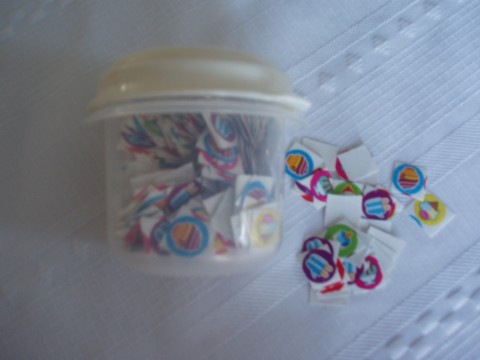
Locate an element on the screen. Image resolution: width=480 pixels, height=360 pixels. cup lid is located at coordinates (200, 76).